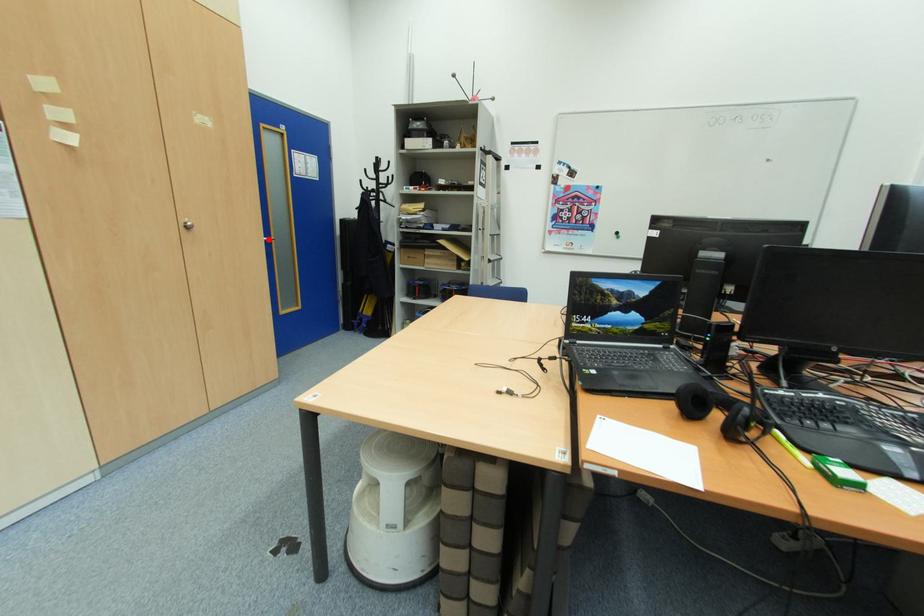
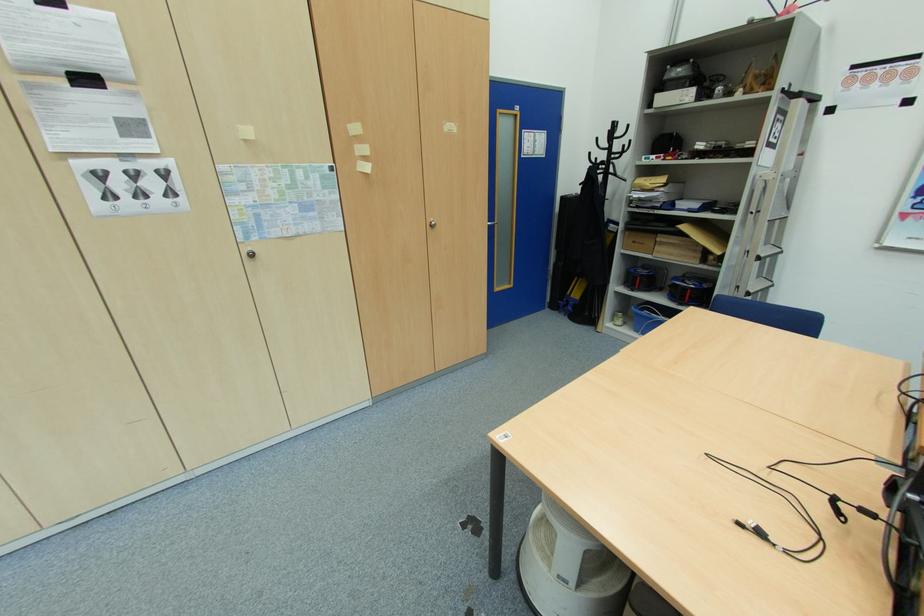
Find the pixel in the second image that matches the highlighted location in the first image.

(493, 224)